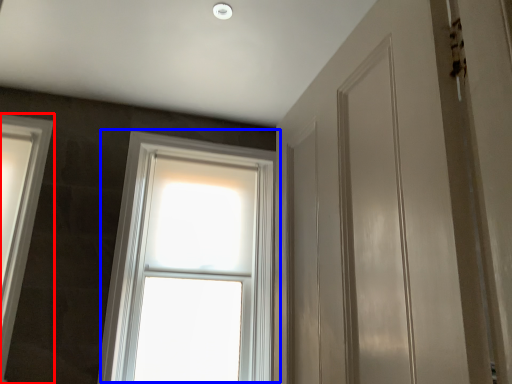
Question: Which point is closer to the camera, window (highlighted by a red box) or window (highlighted by a blue box)?

Choices:
 (A) window
 (B) window

Answer: (A)